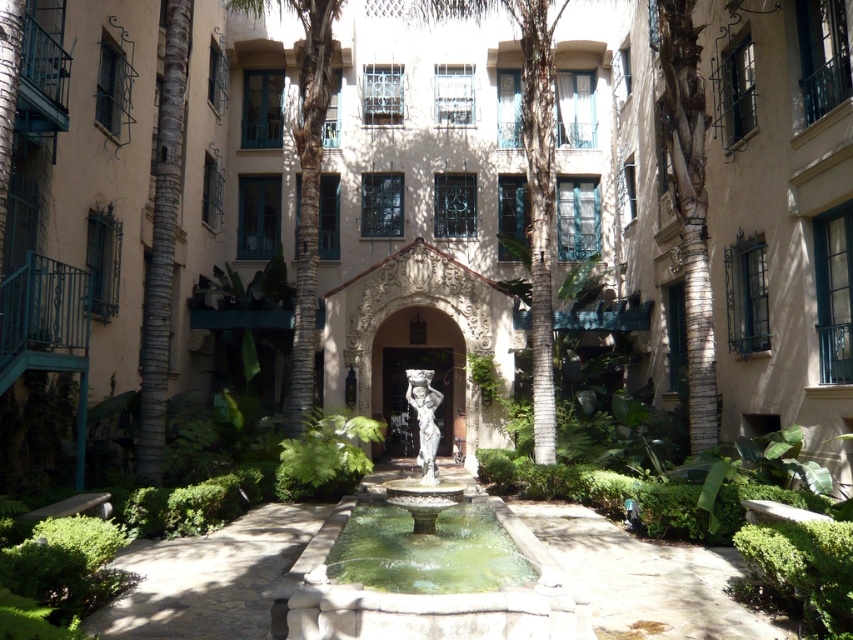
You are standing in the courtyard and want to move from the point at coordinates point (386,547) to the point at coordinates point (426,572). Which direction should you move to reach your destination?

To move from point (386,547) to point (426,572), you should move forward since point (386,547) is behind point (426,572).

You are a maintenance worker in the courtyard. You need to water the green leafy palm tree at center and the green stone pool at center. Your watering hose can reach 20 feet. Can you water both without moving the hose? Please explain.

The green leafy palm tree at center is 20.88 feet away from the green stone pool at center. Since the hose can only reach 20 feet, you cannot water both without moving the hose because the distance between them exceeds the hose length.

You are a visitor in the courtyard and want to take a photo of both the white stone fountain at center and the green stone pool at center. Which object should you focus on first if you want to capture the taller one in your shot?

The white stone fountain at center is taller than the green stone pool at center, so you should focus on the white stone fountain at center first to capture the taller one in your shot.